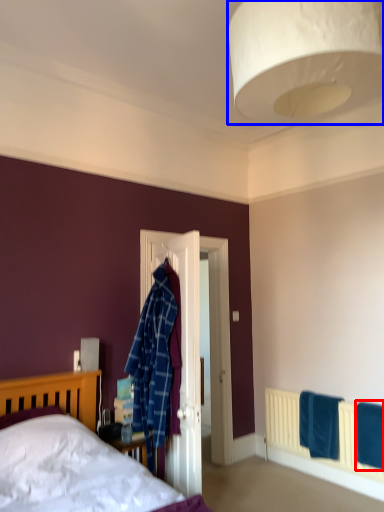
Question: Which point is further to the camera, bath towel (highlighted by a red box) or lamp (highlighted by a blue box)?

Choices:
 (A) bath towel
 (B) lamp

Answer: (A)